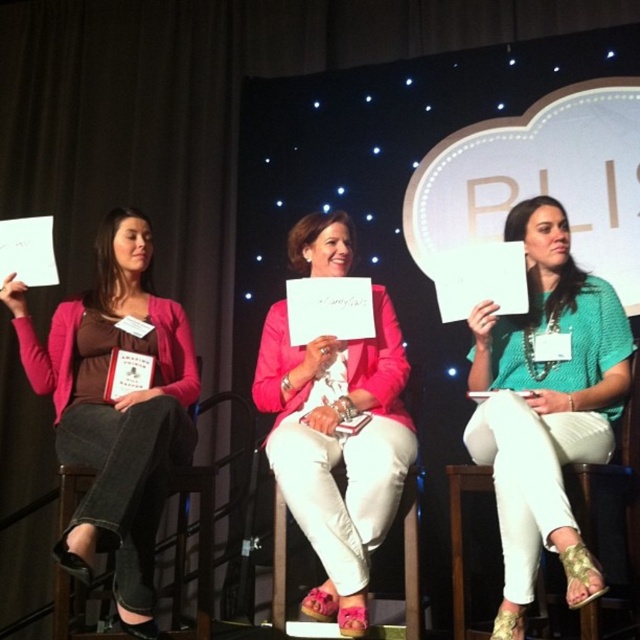
Is green knitted sweater at center further to the viewer compared to denim fabric chair at left?

No, green knitted sweater at center is closer to the viewer.

This screenshot has height=640, width=640. Identify the location of green knitted sweater at center. (545, 406).

Can you confirm if matte pink sweater at left is shorter than denim fabric chair at left?

No, matte pink sweater at left is not shorter than denim fabric chair at left.

Is point (173, 465) positioned before point (113, 636)?

No, it is behind (113, 636).

Locate an element on the screen. The width and height of the screenshot is (640, 640). matte pink sweater at left is located at coordinates [115, 408].

Locate an element on the screen. matte pink sweater at left is located at coordinates (115, 408).

Is matte pink sweater at left to the right of pink fabric jacket at center from the viewer's perspective?

No, matte pink sweater at left is not to the right of pink fabric jacket at center.

Which is above, matte pink sweater at left or pink fabric jacket at center?

matte pink sweater at left is above.

You are a GUI agent. You are given a task and a screenshot of the screen. Output one action in this format:
    pyautogui.click(x=<x>, y=<y>)
    Task: Click on the matte pink sweater at left
    The height and width of the screenshot is (640, 640).
    Given the screenshot: What is the action you would take?
    pyautogui.click(x=115, y=408)

Locate an element on the screen. The width and height of the screenshot is (640, 640). matte pink sweater at left is located at coordinates 115,408.